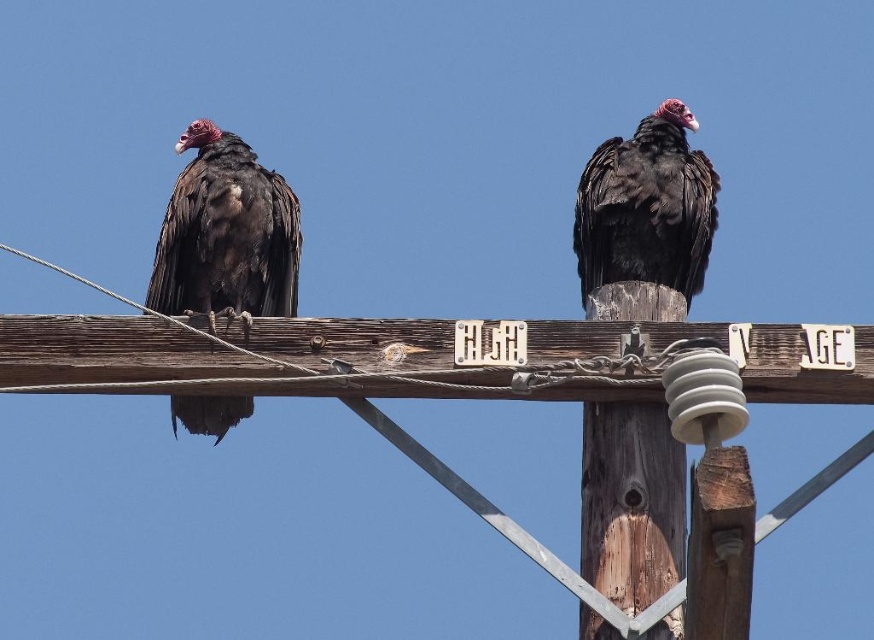
Can you confirm if wooden pole at center is thinner than matte black vulture at left?

No, wooden pole at center is not thinner than matte black vulture at left.

Find the location of a particular element. This screenshot has height=640, width=874. wooden pole at center is located at coordinates (341, 356).

Find the location of `wooden pole at center`. wooden pole at center is located at coordinates (341, 356).

Does wooden pole at center have a greater height compared to black matte vulture at upper right?

In fact, wooden pole at center may be shorter than black matte vulture at upper right.

Between wooden pole at center and black matte vulture at upper right, which one is positioned lower?

Positioned lower is wooden pole at center.

Where is `wooden pole at center`? The width and height of the screenshot is (874, 640). wooden pole at center is located at coordinates (341, 356).

Does wooden pole at center have a greater width compared to weathered wood post at center?

Yes.

Who is positioned more to the left, wooden pole at center or weathered wood post at center?

wooden pole at center

The width and height of the screenshot is (874, 640). I want to click on wooden pole at center, so click(x=341, y=356).

Locate an element on the screen. The image size is (874, 640). wooden pole at center is located at coordinates (341, 356).